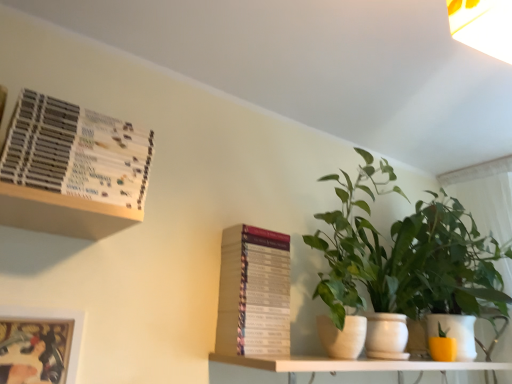
Where is `green leafy plant at right, which appears as the second houseplant when viewed from the left`? green leafy plant at right, which appears as the second houseplant when viewed from the left is located at coordinates (452, 270).

The height and width of the screenshot is (384, 512). What do you see at coordinates (407, 256) in the screenshot?
I see `green leafy plant at right, which ranks as the 1th houseplant in left-to-right order` at bounding box center [407, 256].

In order to face green matte plant at center, should I rotate leftwards or rightwards?

You should rotate right by 12.622 degrees.

What do you see at coordinates (76, 152) in the screenshot?
I see `hardcover book at upper left, the second paperback book positioned from the back` at bounding box center [76, 152].

Where is `white matte shelf at lower center`? white matte shelf at lower center is located at coordinates (351, 364).

Locate an element on the screen. This screenshot has width=512, height=384. hardcover book at center, placed as the 2th paperback book when sorted from front to back is located at coordinates (254, 293).

Image resolution: width=512 pixels, height=384 pixels. Find the location of `yellow matte flowerpot at lower right`. yellow matte flowerpot at lower right is located at coordinates (455, 332).

Between white matte shelf at lower center and green matte plant at center, which one is positioned in front?

white matte shelf at lower center is closer to the camera.

Can you confirm if white matte shelf at lower center is smaller than green matte plant at center?

Yes, white matte shelf at lower center is smaller than green matte plant at center.

Does white matte shelf at lower center appear on the left side of green matte plant at center?

In fact, white matte shelf at lower center is to the right of green matte plant at center.

From a real-world perspective, is white matte shelf at lower center physically located above or below green matte plant at center?

white matte shelf at lower center is situated lower than green matte plant at center in the real world.

From the picture: Considering the sizes of green leafy plant at right, which is counted as the 2th houseplant, starting from the right, and hardcover book at upper left, the 2th paperback book positioned from the right, in the image, is green leafy plant at right, which is counted as the 2th houseplant, starting from the right, bigger or smaller than hardcover book at upper left, the 2th paperback book positioned from the right,?

In the image, green leafy plant at right, which is counted as the 2th houseplant, starting from the right, appears to be larger than hardcover book at upper left, the 2th paperback book positioned from the right.

Can you confirm if green leafy plant at right, which is counted as the 2th houseplant, starting from the right, is positioned to the right of hardcover book at upper left, which is counted as the 2th paperback book, starting from the bottom?

Correct, you'll find green leafy plant at right, which is counted as the 2th houseplant, starting from the right, to the right of hardcover book at upper left, which is counted as the 2th paperback book, starting from the bottom.

Which object is wider, green leafy plant at right, which ranks as the 1th houseplant in left-to-right order, or hardcover book at upper left, positioned as the first paperback book in left-to-right order?

Wider between the two is green leafy plant at right, which ranks as the 1th houseplant in left-to-right order.

Which object is further away from the camera, hardcover book at upper left, which ranks as the first paperback book in front-to-back order, or hardcover book at center, the first paperback book when ordered from right to left?

hardcover book at center, the first paperback book when ordered from right to left, is more distant.

Is hardcover book at upper left, the 2th paperback book positioned from the right, far from hardcover book at center, arranged as the 2th paperback book when viewed from the top?

hardcover book at upper left, the 2th paperback book positioned from the right, is actually quite close to hardcover book at center, arranged as the 2th paperback book when viewed from the top.

Is hardcover book at upper left, positioned as the first paperback book in left-to-right order, turned away from hardcover book at center, placed as the 2th paperback book when sorted from front to back?

No, hardcover book at upper left, positioned as the first paperback book in left-to-right order, is not facing away from hardcover book at center, placed as the 2th paperback book when sorted from front to back.

Considering the points (114, 148) and (351, 223), which point is in front, point (114, 148) or point (351, 223)?

The point (114, 148) is in front.

Consider the image. Relative to green leafy plant at right, which is counted as the 2th houseplant, starting from the right, is hardcover book at upper left, the 2th paperback book positioned from the right, in front or behind?

hardcover book at upper left, the 2th paperback book positioned from the right, is in front of green leafy plant at right, which is counted as the 2th houseplant, starting from the right.

Which houseplant is the 1st one when counting from the right side of the hardcover book at upper left, positioned as the first paperback book in left-to-right order? Please provide its 2D coordinates.

[(407, 256)]

From a real-world perspective, is hardcover book at center, placed as the 2th paperback book when sorted from front to back, on top of yellow matte flowerpot at lower right?

Yes, from a real-world perspective, hardcover book at center, placed as the 2th paperback book when sorted from front to back, is above yellow matte flowerpot at lower right.

Is hardcover book at center, which is the 1th paperback book in back-to-front order, wider or thinner than yellow matte flowerpot at lower right?

hardcover book at center, which is the 1th paperback book in back-to-front order, is wider than yellow matte flowerpot at lower right.

Based on the photo, does hardcover book at center, the second paperback book positioned from the left, turn towards yellow matte flowerpot at lower right?

No, hardcover book at center, the second paperback book positioned from the left, is not oriented towards yellow matte flowerpot at lower right.

Relative to yellow matte flowerpot at lower right, is hardcover book at center, which is the 1th paperback book in back-to-front order, in front or behind?

hardcover book at center, which is the 1th paperback book in back-to-front order, is in front of yellow matte flowerpot at lower right.

From the image's perspective, is green leafy plant at right, the first houseplant from the right, located above or below hardcover book at upper left, which is counted as the 2th paperback book, starting from the bottom?

Based on their image positions, green leafy plant at right, the first houseplant from the right, is located beneath hardcover book at upper left, which is counted as the 2th paperback book, starting from the bottom.

From a real-world perspective, which object rests below the other?

From a 3D spatial view, green leafy plant at right, the first houseplant from the right, is below.

Is green leafy plant at right, which appears as the second houseplant when viewed from the left, oriented away from hardcover book at upper left, which is counted as the 2th paperback book, starting from the bottom?

No, hardcover book at upper left, which is counted as the 2th paperback book, starting from the bottom, is not at the back of green leafy plant at right, which appears as the second houseplant when viewed from the left.

Is green leafy plant at right, which appears as the second houseplant when viewed from the left, not within hardcover book at upper left, which is the 1th paperback book from top to bottom?

Yes, green leafy plant at right, which appears as the second houseplant when viewed from the left, is outside of hardcover book at upper left, which is the 1th paperback book from top to bottom.

Where is `paperback book that is the 1st object to the left of the green matte plant at center, starting at the anchor`? paperback book that is the 1st object to the left of the green matte plant at center, starting at the anchor is located at coordinates (254, 293).

Considering the points (275, 284) and (407, 298), which point is behind, point (275, 284) or point (407, 298)?

Point (407, 298)

Can you confirm if hardcover book at center, the first paperback book in the bottom-to-top sequence, is positioned to the left of green matte plant at center?

Yes.

Considering the positions of objects hardcover book at center, arranged as the 2th paperback book when viewed from the top, and green matte plant at center in the image provided, who is behind, hardcover book at center, arranged as the 2th paperback book when viewed from the top, or green matte plant at center?

hardcover book at center, arranged as the 2th paperback book when viewed from the top, is further from the camera.

Identify the location of shelf to the right of green matte plant at center. The image size is (512, 384). (351, 364).

This screenshot has height=384, width=512. In the image, there is a green leafy plant at right, which ranks as the 1th houseplant in left-to-right order. Find the location of `paperback book above it (from the image's perspective)`. paperback book above it (from the image's perspective) is located at coordinates (76, 152).

Considering their positions, is yellow matte flowerpot at lower right positioned further to hardcover book at center, placed as the 2th paperback book when sorted from front to back, than hardcover book at upper left, which is the 1th paperback book from top to bottom?

Based on the image, yellow matte flowerpot at lower right appears to be further to hardcover book at center, placed as the 2th paperback book when sorted from front to back.

Looking at the image, which one is located closer to green matte plant at center, yellow matte flowerpot at lower right or hardcover book at upper left, the 2th paperback book positioned from the right?

yellow matte flowerpot at lower right is closer to green matte plant at center.

From the image, which object appears to be nearer to hardcover book at upper left, positioned as the first paperback book in left-to-right order, green leafy plant at right, which is counted as the 2th houseplant, starting from the right, or white matte shelf at lower center?

Based on the image, white matte shelf at lower center appears to be nearer to hardcover book at upper left, positioned as the first paperback book in left-to-right order.

When comparing their distances from hardcover book at center, which is the 1th paperback book in back-to-front order, does hardcover book at upper left, which is counted as the 2th paperback book, starting from the bottom, or green matte plant at center seem closer?

green matte plant at center.

Looking at the image, which one is located closer to hardcover book at upper left, positioned as the first paperback book in left-to-right order, green matte plant at center or green leafy plant at right, which ranks as the 1th houseplant in left-to-right order?

green matte plant at center lies closer to hardcover book at upper left, positioned as the first paperback book in left-to-right order, than the other object.

Which object lies further to the anchor point green leafy plant at right, which is counted as the 2th houseplant, starting from the right, green matte plant at center or hardcover book at upper left, the second paperback book positioned from the back?

hardcover book at upper left, the second paperback book positioned from the back, is positioned further to the anchor green leafy plant at right, which is counted as the 2th houseplant, starting from the right.

When comparing their distances from yellow matte flowerpot at lower right, does green matte plant at center or metallic silver picture frame at lower left seem further?

Among the two, metallic silver picture frame at lower left is located further to yellow matte flowerpot at lower right.

Looking at the image, which one is located further to green leafy plant at right, which appears as the second houseplant when viewed from the left, green matte plant at center or yellow matte flowerpot at lower right?

green matte plant at center is further to green leafy plant at right, which appears as the second houseplant when viewed from the left.

Identify the location of vegetation between metallic silver picture frame at lower left and yellow matte flowerpot at lower right. (361, 251).

The width and height of the screenshot is (512, 384). In order to click on vegetation between metallic silver picture frame at lower left and green leafy plant at right, which ranks as the 1th houseplant in left-to-right order, from left to right in this screenshot , I will do (361, 251).

Find the location of `houseplant situated between green matte plant at center and green leafy plant at right, the first houseplant from the right, from left to right`. houseplant situated between green matte plant at center and green leafy plant at right, the first houseplant from the right, from left to right is located at coordinates (407, 256).

Find the location of `vegetation between hardcover book at upper left, which ranks as the first paperback book in front-to-back order, and green leafy plant at right, the first houseplant from the right, from left to right`. vegetation between hardcover book at upper left, which ranks as the first paperback book in front-to-back order, and green leafy plant at right, the first houseplant from the right, from left to right is located at coordinates (361, 251).